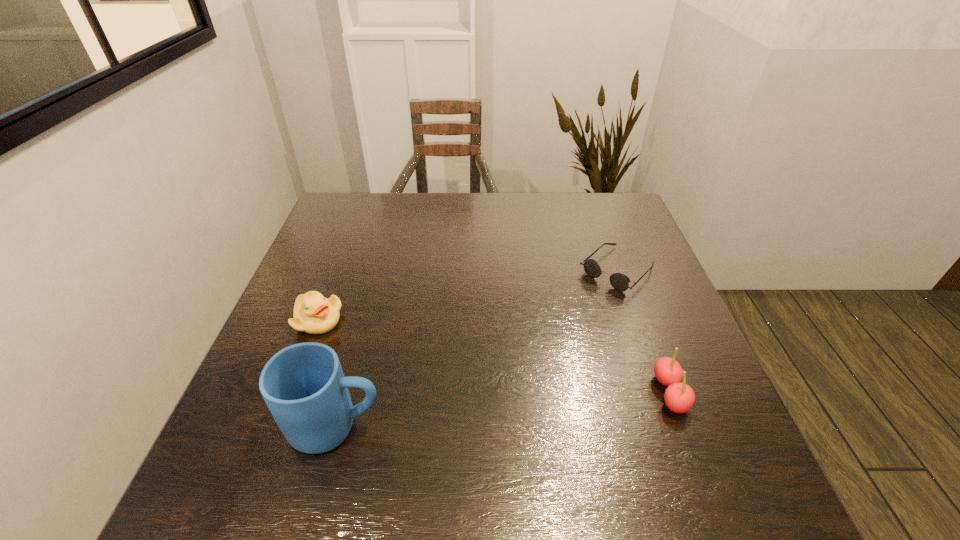
Locate an element on the screen. This screenshot has width=960, height=540. free space located on the front-facing side of the shortest object is located at coordinates (548, 336).

Image resolution: width=960 pixels, height=540 pixels. What are the coordinates of `free point located 0.310m on the front-facing side of the shortest object` in the screenshot? It's located at (521, 362).

Find the location of `free point located 0.210m on the front-facing side of the shortest object`. free point located 0.210m on the front-facing side of the shortest object is located at coordinates (548, 336).

Identify the location of mug present at the near edge. This screenshot has width=960, height=540. (303, 385).

Locate an element on the screen. cherry present at the near edge is located at coordinates (679, 397).

Find the location of `mug situated at the left edge`. mug situated at the left edge is located at coordinates (303, 385).

I want to click on duckling located at the left edge, so 313,313.

At what (x,y) coordinates should I click in order to perform the action: click on cherry present at the right edge. Please return your answer as a coordinate pair (x, y). Image resolution: width=960 pixels, height=540 pixels. Looking at the image, I should click on (679, 397).

Locate an element on the screen. Image resolution: width=960 pixels, height=540 pixels. sunglasses that is positioned at the right edge is located at coordinates (619, 281).

What are the coordinates of `object that is at the near left corner` in the screenshot? It's located at pyautogui.click(x=303, y=385).